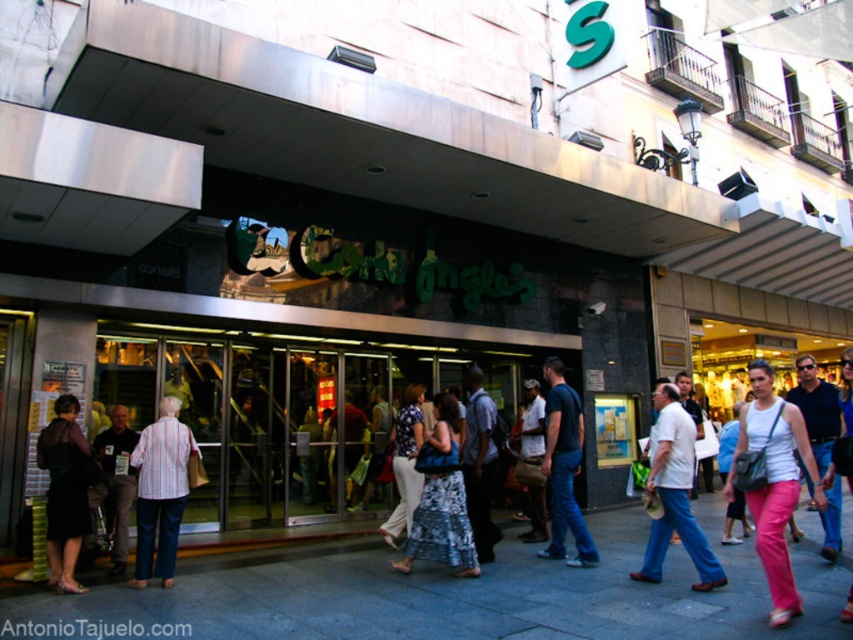
Question: Which point is closer to the camera?

Choices:
 (A) (142, 438)
 (B) (439, 410)

Answer: (A)

Question: Is gray concrete pavement at center further to camera compared to white matte shirt at center?

Choices:
 (A) no
 (B) yes

Answer: (B)

Question: Does striped cotton shirt at center have a smaller size compared to pink cotton pants at lower right?

Choices:
 (A) no
 (B) yes

Answer: (A)

Question: Among these points, which one is nearest to the camera?

Choices:
 (A) (161, 520)
 (B) (47, 460)
 (C) (392, 540)

Answer: (B)

Question: Can you confirm if striped cotton shirt at center is positioned to the left of pink cotton pants at lower right?

Choices:
 (A) yes
 (B) no

Answer: (A)

Question: Among these points, which one is nearest to the camera?

Choices:
 (A) (534, 426)
 (B) (572, 448)

Answer: (B)